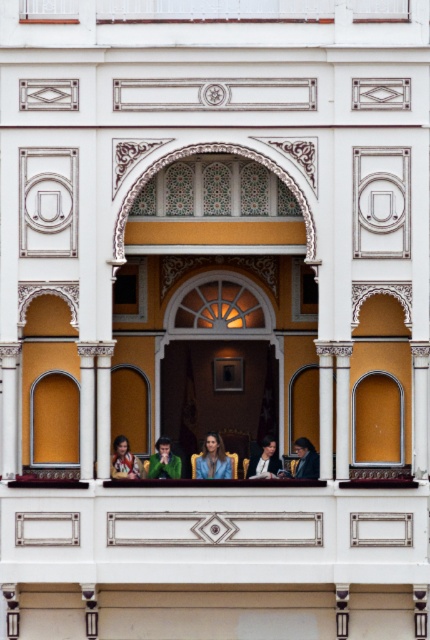
Who is more forward, (x=150, y=472) or (x=276, y=456)?

Point (x=150, y=472) is in front.

Who is more distant from viewer, (x=159, y=452) or (x=260, y=460)?

The point (x=260, y=460) is behind.

Image resolution: width=430 pixels, height=640 pixels. I want to click on green velvet chair at center, so click(163, 460).

From the picture: Does green velvet chair at center come behind dark blue suit at lower right?

Yes, it is behind dark blue suit at lower right.

Is point (162, 458) positioned after point (310, 449)?

That is False.

Find the location of a particular element. green velvet chair at center is located at coordinates (163, 460).

Between point (227, 456) and point (248, 474), which one is positioned behind?

The point (248, 474) is more distant.

Who is more distant from viewer, [217,468] or [272,465]?

Positioned behind is point [272,465].

Identify the location of smooth blue shirt at center. The height and width of the screenshot is (640, 430). (212, 458).